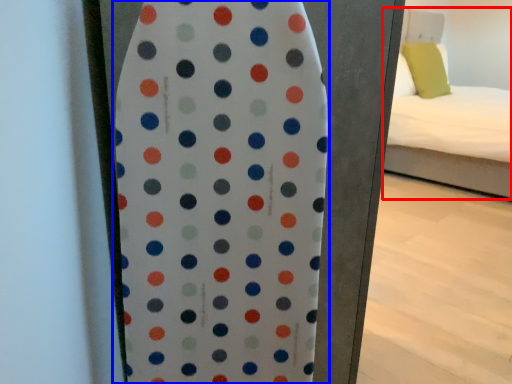
Question: Among these objects, which one is farthest to the camera, bed (highlighted by a red box) or surfboard (highlighted by a blue box)?

Choices:
 (A) bed
 (B) surfboard

Answer: (A)